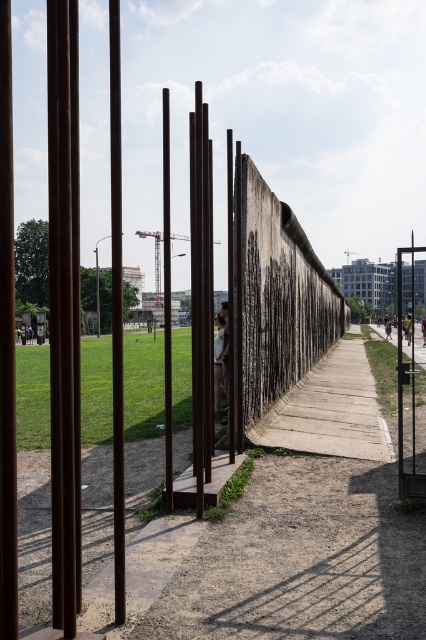
Who is shorter, rustic wood pole at center or smooth gray statue at center?

Standing shorter between the two is smooth gray statue at center.

Between rustic wood pole at center and smooth gray statue at center, which one appears on the right side from the viewer's perspective?

Positioned to the right is smooth gray statue at center.

Who is more distant from viewer, (115, 276) or (221, 385)?

The point (221, 385) is behind.

The height and width of the screenshot is (640, 426). Find the location of `rustic wood pole at center`. rustic wood pole at center is located at coordinates (117, 312).

Does weathered concrete wall at center have a greater height compared to rustic wood pole at center?

No.

Who is more forward, (319, 316) or (118, 396)?

Positioned in front is point (118, 396).

Find the location of a particular element. This screenshot has height=640, width=426. weathered concrete wall at center is located at coordinates (279, 298).

Locate an element on the screen. rusty metal pole at left is located at coordinates (63, 308).

Is point (66, 244) positioned after point (166, 164)?

No, it is not.

The image size is (426, 640). Identify the location of rusty metal pole at left. (63, 308).